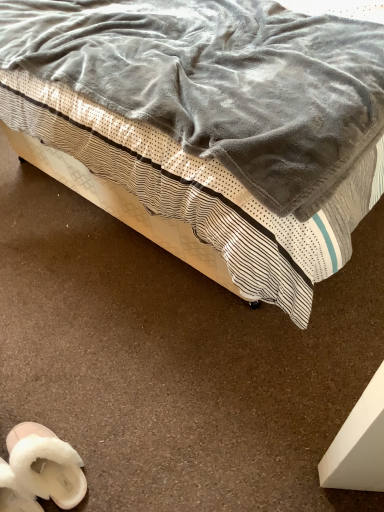
Locate an element on the screen. The height and width of the screenshot is (512, 384). white fluffy slippers at lower left, marked as the first footwear in a right-to-left arrangement is located at coordinates (39, 470).

Image resolution: width=384 pixels, height=512 pixels. What do you see at coordinates (39, 470) in the screenshot?
I see `white fluffy slippers at lower left, marked as the first footwear in a right-to-left arrangement` at bounding box center [39, 470].

Where is `white fluffy slippers at lower left, arranged as the 1th footwear when viewed from the left`? The image size is (384, 512). white fluffy slippers at lower left, arranged as the 1th footwear when viewed from the left is located at coordinates (15, 493).

Can you confirm if white fluffy slippers at lower left, marked as the first footwear in a right-to-left arrangement, is smaller than white fluffy slippers at lower left, arranged as the 1th footwear when viewed from the left?

No.

Considering the sizes of objects white fluffy slippers at lower left, marked as the first footwear in a right-to-left arrangement, and white fluffy slippers at lower left, arranged as the 1th footwear when viewed from the left, in the image provided, who is shorter, white fluffy slippers at lower left, marked as the first footwear in a right-to-left arrangement, or white fluffy slippers at lower left, arranged as the 1th footwear when viewed from the left,?

With less height is white fluffy slippers at lower left, arranged as the 1th footwear when viewed from the left.

Based on the photo, measure the distance from white fluffy slippers at lower left, marked as the first footwear in a right-to-left arrangement, to white fluffy slippers at lower left, arranged as the 1th footwear when viewed from the left.

The distance of white fluffy slippers at lower left, marked as the first footwear in a right-to-left arrangement, from white fluffy slippers at lower left, arranged as the 1th footwear when viewed from the left, is 4.50 centimeters.

Is white fluffy slippers at lower left, arranged as the 1th footwear when viewed from the left, a part of white fluffy slippers at lower left, marked as the first footwear in a right-to-left arrangement?

No, white fluffy slippers at lower left, marked as the first footwear in a right-to-left arrangement, does not contain white fluffy slippers at lower left, arranged as the 1th footwear when viewed from the left.

In terms of height, does white fluffy slippers at lower left, positioned as the second footwear in right-to-left order, look taller or shorter compared to white fluffy slippers at lower left, marked as the second footwear in a left-to-right arrangement?

Clearly, white fluffy slippers at lower left, positioned as the second footwear in right-to-left order, is shorter compared to white fluffy slippers at lower left, marked as the second footwear in a left-to-right arrangement.

Is point (33, 509) farther from viewer compared to point (79, 473)?

No, (33, 509) is in front of (79, 473).

Could you tell me if white fluffy slippers at lower left, positioned as the second footwear in right-to-left order, is facing white fluffy slippers at lower left, marked as the first footwear in a right-to-left arrangement?

No.

Could you measure the distance between white fluffy slippers at lower left, marked as the first footwear in a right-to-left arrangement, and velvet gray blanket at upper center?

white fluffy slippers at lower left, marked as the first footwear in a right-to-left arrangement, is 35.21 inches from velvet gray blanket at upper center.

Which of these two, white fluffy slippers at lower left, marked as the first footwear in a right-to-left arrangement, or velvet gray blanket at upper center, is smaller?

white fluffy slippers at lower left, marked as the first footwear in a right-to-left arrangement.

Which object is thinner, white fluffy slippers at lower left, marked as the second footwear in a left-to-right arrangement, or velvet gray blanket at upper center?

With smaller width is white fluffy slippers at lower left, marked as the second footwear in a left-to-right arrangement.

Relative to velvet gray blanket at upper center, is white fluffy slippers at lower left, marked as the first footwear in a right-to-left arrangement, in front or behind?

white fluffy slippers at lower left, marked as the first footwear in a right-to-left arrangement, is positioned farther from the viewer than velvet gray blanket at upper center.

Is velvet gray blanket at upper center further to the viewer compared to white fluffy slippers at lower left, positioned as the second footwear in right-to-left order?

No, velvet gray blanket at upper center is closer to the viewer.

Does velvet gray blanket at upper center turn towards white fluffy slippers at lower left, arranged as the 1th footwear when viewed from the left?

Yes.

Which is closer, (247,110) or (2,460)?

Positioned in front is point (247,110).

Based on the photo, is white fluffy slippers at lower left, arranged as the 1th footwear when viewed from the left, far away from velvet gray blanket at upper center?

white fluffy slippers at lower left, arranged as the 1th footwear when viewed from the left, is positioned a significant distance from velvet gray blanket at upper center.

Considering the relative positions of white fluffy slippers at lower left, arranged as the 1th footwear when viewed from the left, and velvet gray blanket at upper center in the image provided, is white fluffy slippers at lower left, arranged as the 1th footwear when viewed from the left, to the left or to the right of velvet gray blanket at upper center?

Based on their positions, white fluffy slippers at lower left, arranged as the 1th footwear when viewed from the left, is located to the left of velvet gray blanket at upper center.

Does white fluffy slippers at lower left, arranged as the 1th footwear when viewed from the left, lie in front of velvet gray blanket at upper center?

No, white fluffy slippers at lower left, arranged as the 1th footwear when viewed from the left, is further to the viewer.

From a real-world perspective, which object stands above the other?

velvet gray blanket at upper center.

Is velvet gray blanket at upper center not within white fluffy slippers at lower left, marked as the first footwear in a right-to-left arrangement?

Yes, velvet gray blanket at upper center is outside of white fluffy slippers at lower left, marked as the first footwear in a right-to-left arrangement.

Consider the image. How different are the orientations of velvet gray blanket at upper center and white fluffy slippers at lower left, marked as the first footwear in a right-to-left arrangement, in degrees?

The facing directions of velvet gray blanket at upper center and white fluffy slippers at lower left, marked as the first footwear in a right-to-left arrangement, are 89.2 degrees apart.

Considering the sizes of objects velvet gray blanket at upper center and white fluffy slippers at lower left, marked as the first footwear in a right-to-left arrangement, in the image provided, who is shorter, velvet gray blanket at upper center or white fluffy slippers at lower left, marked as the first footwear in a right-to-left arrangement,?

With less height is white fluffy slippers at lower left, marked as the first footwear in a right-to-left arrangement.

You are a GUI agent. You are given a task and a screenshot of the screen. Output one action in this format:
    pyautogui.click(x=<x>, y=<y>)
    Task: Click on the footwear above the white fluffy slippers at lower left, arranged as the 1th footwear when viewed from the left (from a real-world perspective)
    The height and width of the screenshot is (512, 384).
    Given the screenshot: What is the action you would take?
    pyautogui.click(x=39, y=470)

Find the location of a particular element. This screenshot has height=512, width=384. footwear on the left of the white fluffy slippers at lower left, marked as the second footwear in a left-to-right arrangement is located at coordinates (15, 493).

Which object lies nearer to the anchor point white fluffy slippers at lower left, marked as the second footwear in a left-to-right arrangement, velvet gray blanket at upper center or white fluffy slippers at lower left, arranged as the 1th footwear when viewed from the left?

Based on the image, white fluffy slippers at lower left, arranged as the 1th footwear when viewed from the left, appears to be nearer to white fluffy slippers at lower left, marked as the second footwear in a left-to-right arrangement.

Looking at the image, which one is located closer to white fluffy slippers at lower left, positioned as the second footwear in right-to-left order, white fluffy slippers at lower left, marked as the first footwear in a right-to-left arrangement, or velvet gray blanket at upper center?

Based on the image, white fluffy slippers at lower left, marked as the first footwear in a right-to-left arrangement, appears to be nearer to white fluffy slippers at lower left, positioned as the second footwear in right-to-left order.

Estimate the real-world distances between objects in this image. Which object is further from white fluffy slippers at lower left, arranged as the 1th footwear when viewed from the left, velvet gray blanket at upper center or white fluffy slippers at lower left, marked as the second footwear in a left-to-right arrangement?

Among the two, velvet gray blanket at upper center is located further to white fluffy slippers at lower left, arranged as the 1th footwear when viewed from the left.

Which object lies nearer to the anchor point white fluffy slippers at lower left, marked as the first footwear in a right-to-left arrangement, white fluffy slippers at lower left, arranged as the 1th footwear when viewed from the left, or velvet gray blanket at upper center?

white fluffy slippers at lower left, arranged as the 1th footwear when viewed from the left, is closer to white fluffy slippers at lower left, marked as the first footwear in a right-to-left arrangement.

Considering their positions, is white fluffy slippers at lower left, arranged as the 1th footwear when viewed from the left, positioned further to velvet gray blanket at upper center than white fluffy slippers at lower left, marked as the second footwear in a left-to-right arrangement?

Among the two, white fluffy slippers at lower left, arranged as the 1th footwear when viewed from the left, is located further to velvet gray blanket at upper center.

Based on their spatial positions, is white fluffy slippers at lower left, marked as the second footwear in a left-to-right arrangement, or white fluffy slippers at lower left, positioned as the second footwear in right-to-left order, closer to velvet gray blanket at upper center?

white fluffy slippers at lower left, marked as the second footwear in a left-to-right arrangement.

Find the location of a particular element. The width and height of the screenshot is (384, 512). footwear between velvet gray blanket at upper center and white fluffy slippers at lower left, arranged as the 1th footwear when viewed from the left, in the vertical direction is located at coordinates (39, 470).